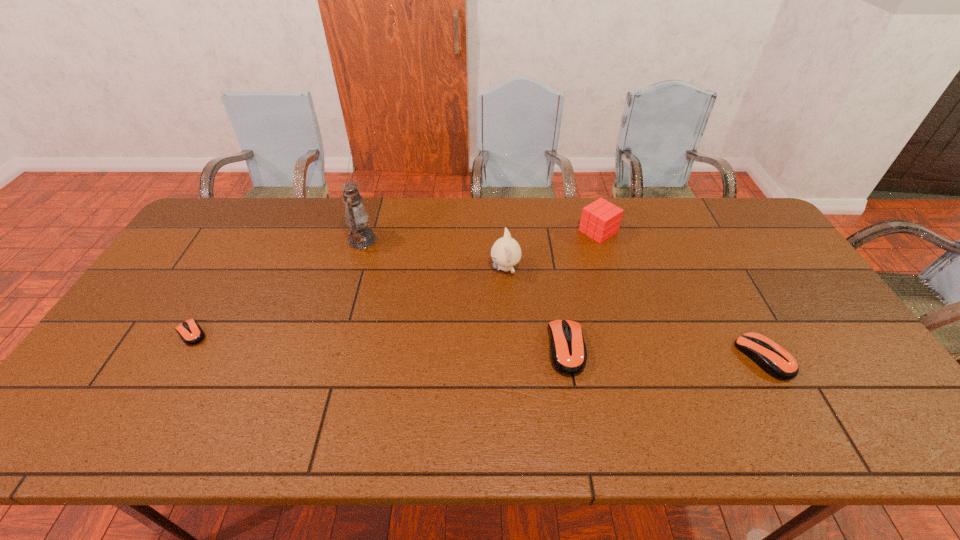
At what (x,y) coordinates should I click in order to perform the action: click on computer mouse that is the second nearest to the fifth shortest object. Please return your answer as a coordinate pair (x, y). Looking at the image, I should click on (776, 361).

Select which computer mouse is the second closest to the shortest computer mouse. Please provide its 2D coordinates. Your answer should be formatted as a tuple, i.e. [(x, y)], where the tuple contains the x and y coordinates of a point satisfying the conditions above.

[(776, 361)]

This screenshot has width=960, height=540. What are the coordinates of `vacant area that satisfies the following two spatial constraints: 1. on the front side of the fifth object from left to right; 2. on the right side of the rightmost object` in the screenshot? It's located at (636, 357).

This screenshot has height=540, width=960. I want to click on vacant region that satisfies the following two spatial constraints: 1. on the back side of the rightmost computer mouse; 2. on the face of the kitten, so click(x=714, y=268).

This screenshot has width=960, height=540. Identify the location of vacant region that satisfies the following two spatial constraints: 1. on the face of the fifth shortest object; 2. on the front side of the leftmost computer mouse. (509, 333).

You are a GUI agent. You are given a task and a screenshot of the screen. Output one action in this format:
    pyautogui.click(x=<x>, y=<y>)
    Task: Click on the vacant space that satisfies the following two spatial constraints: 1. on the front side of the third object from right to left; 2. on the right side of the tallest object
    
    Given the screenshot: What is the action you would take?
    pyautogui.click(x=330, y=349)

Locate an element on the screen. The height and width of the screenshot is (540, 960). free spot that satisfies the following two spatial constraints: 1. on the back side of the second object from left to right; 2. on the right side of the shortest computer mouse is located at coordinates (245, 240).

Where is `free location that satisfies the following two spatial constraints: 1. on the face of the kitten; 2. on the left side of the second tallest computer mouse`? Image resolution: width=960 pixels, height=540 pixels. free location that satisfies the following two spatial constraints: 1. on the face of the kitten; 2. on the left side of the second tallest computer mouse is located at coordinates point(511,357).

The height and width of the screenshot is (540, 960). I want to click on vacant space that satisfies the following two spatial constraints: 1. on the face of the fourth object from right to left; 2. on the back side of the fourth object from left to right, so click(510, 349).

You are a GUI agent. You are given a task and a screenshot of the screen. Output one action in this format:
    pyautogui.click(x=<x>, y=<y>)
    Task: Click on the free point that satisfies the following two spatial constraints: 1. on the face of the fourth nearest object; 2. on the back side of the rightmost object
    
    Given the screenshot: What is the action you would take?
    pyautogui.click(x=511, y=357)